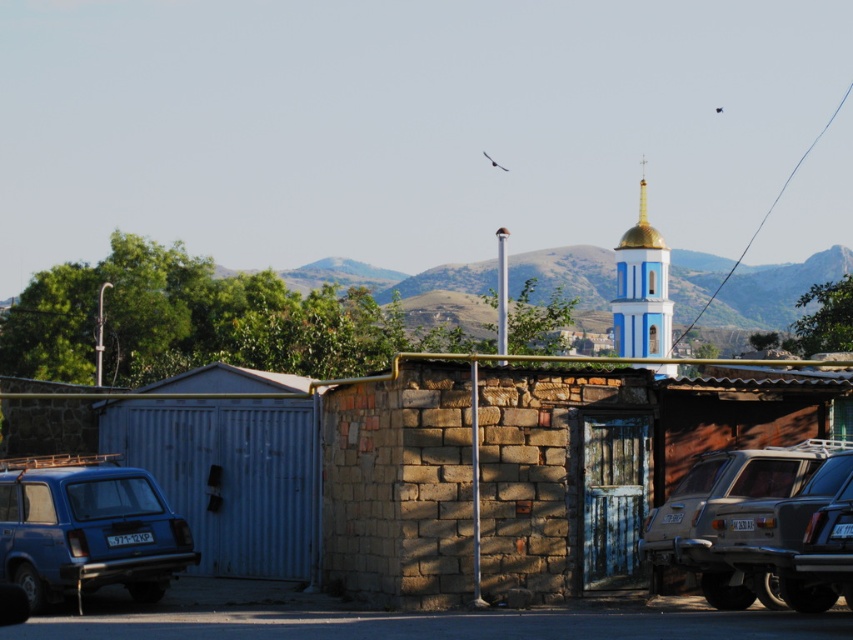
You are standing at the entrance of the small structure with the blue door and want to move to the matte blue suv at lower left. Based on their positions, can you determine if the suv is positioned to your left or right side?

The matte blue suv at lower left is located at point (86, 529), which places it to your left side relative to your position at the entrance of the structure with the blue door.

You are driving a car and want to park it between the brown brick hut at center and the matte blue suv at lower left. Is there enough space between them to park your car?

→ The brown brick hut at center is positioned on the right side of the matte blue suv at lower left, so there is space between them. However, the exact width isn not provided, so it depends on your car size.